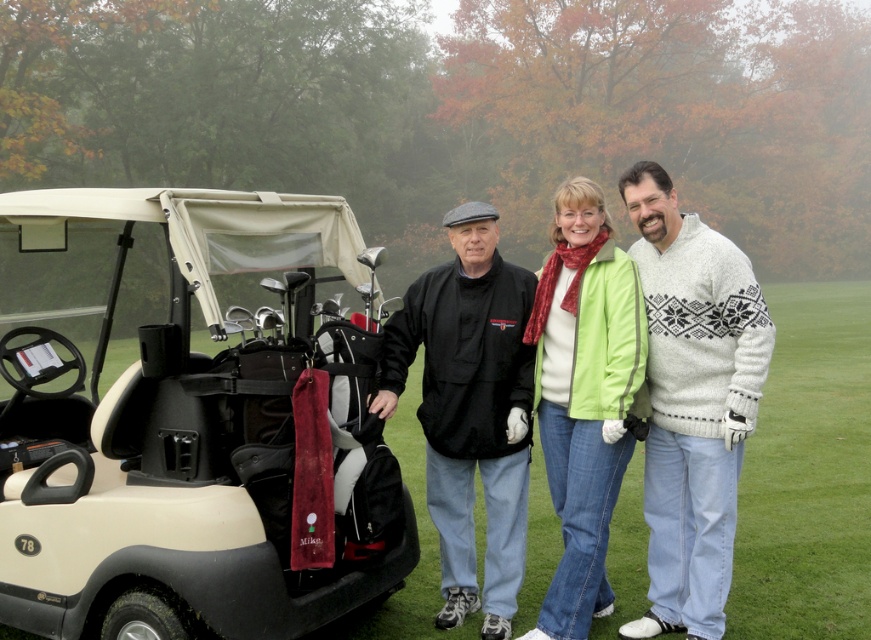
You are a golfer who wants to retrieve your green matte jacket at center from the beige matte golf cart at left. Can you reach it without climbing into the cart?

The beige matte golf cart at left is taller than the green matte jacket at center, so you may need to climb into the cart to reach the jacket since the cart is higher than the jacket.

You are a golfer who just arrived at the course and need to decide whether to store your green matte jacket at center in the beige matte golf cart at left. Based on the scene, can you fit your jacket inside the golf cart?

The beige matte golf cart at left is larger in size than the green matte jacket at center, so yes, the jacket should fit inside the golf cart.